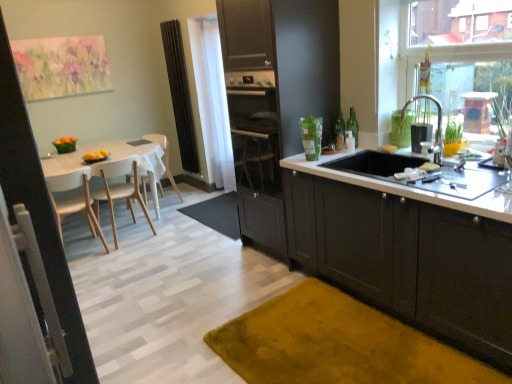
Find the location of a particular element. The image size is (512, 384). matte black cabinets at lower right, the second cabinetry viewed from the left is located at coordinates (408, 260).

Image resolution: width=512 pixels, height=384 pixels. What do you see at coordinates (74, 199) in the screenshot?
I see `white wood chair at left, the first chair positioned from the front` at bounding box center [74, 199].

This screenshot has height=384, width=512. What do you see at coordinates (395, 57) in the screenshot? I see `transparent glass window at upper right` at bounding box center [395, 57].

This screenshot has width=512, height=384. In order to click on mustard yellow carpet at lower right, arranged as the first doormat when viewed from the front in this screenshot , I will do `click(338, 344)`.

This screenshot has width=512, height=384. In order to click on black rubber doormat at center, marked as the first doormat in a back-to-front arrangement in this screenshot , I will do `click(217, 214)`.

Is silver metallic faucet at upper right touching light wood chair at left, the first chair when ordered from back to front?

No, silver metallic faucet at upper right is not making contact with light wood chair at left, the first chair when ordered from back to front.

Which is more to the left, silver metallic faucet at upper right or light wood chair at left, the first chair when ordered from back to front?

From the viewer's perspective, light wood chair at left, the first chair when ordered from back to front, appears more on the left side.

From the image's perspective, is silver metallic faucet at upper right above light wood chair at left, the first chair when ordered from back to front?

Yes, from the image's perspective, silver metallic faucet at upper right is on top of light wood chair at left, the first chair when ordered from back to front.

How different are the orientations of silver metallic faucet at upper right and light wood chair at left, the first chair when ordered from back to front, in degrees?

6.84 degrees separate the facing orientations of silver metallic faucet at upper right and light wood chair at left, the first chair when ordered from back to front.

Is white glossy screen door at upper left in front of transparent glass window at upper right?

Yes, the depth of white glossy screen door at upper left is less than that of transparent glass window at upper right.

Could you tell me if white glossy screen door at upper left is facing transparent glass window at upper right?

Yes, white glossy screen door at upper left is facing transparent glass window at upper right.

Which is farther from the camera, (163, 143) or (382, 184)?

The point (163, 143) is more distant.

From the image's perspective, who appears lower, light wood chair at left, the first chair when ordered from back to front, or white glossy countertop at lower right?

white glossy countertop at lower right appears lower in the image.

Considering the relative positions of light wood chair at left, arranged as the 3th chair when viewed from the front, and white glossy countertop at lower right in the image provided, is light wood chair at left, arranged as the 3th chair when viewed from the front, to the left or to the right of white glossy countertop at lower right?

From the image, it's evident that light wood chair at left, arranged as the 3th chair when viewed from the front, is to the left of white glossy countertop at lower right.

From a real-world perspective, which object rests below the other?

In real-world perspective, light wood chair at left, arranged as the 3th chair when viewed from the front, is lower.

Which object is positioned more to the left, white wood chair at left, the 3th chair when ordered from back to front, or green glass bottle at upper right, the 1th bottle in the right-to-left sequence?

Positioned to the left is white wood chair at left, the 3th chair when ordered from back to front.

Which point is more forward, (94, 235) or (350, 128)?

The point (350, 128) is closer.

Is white wood chair at left, the 3th chair when ordered from back to front, not inside green glass bottle at upper right, the 1th bottle in the right-to-left sequence?

Yes.

How many degrees apart are the facing directions of white wood chair at left, the first chair positioned from the front, and matte black cabinets at lower right, the second cabinetry viewed from the left?

white wood chair at left, the first chair positioned from the front, and matte black cabinets at lower right, the second cabinetry viewed from the left, are facing 89.1 degrees away from each other.

Is white wood chair at left, the 3th chair when ordered from back to front, not close to matte black cabinets at lower right, the second cabinetry viewed from the left?

That's right, there is a large distance between white wood chair at left, the 3th chair when ordered from back to front, and matte black cabinets at lower right, the second cabinetry viewed from the left.

Is point (84, 204) positioned after point (370, 236)?

Yes, it is.

Is the position of matte black cabinets at lower right, the second cabinetry viewed from the left, less distant than that of mustard yellow carpet at lower right, the second doormat viewed from the back?

That is False.

Could you measure the distance between matte black cabinets at lower right, the second cabinetry viewed from the left, and mustard yellow carpet at lower right, the second doormat in the top-to-bottom sequence?

A distance of 16.49 inches exists between matte black cabinets at lower right, the second cabinetry viewed from the left, and mustard yellow carpet at lower right, the second doormat in the top-to-bottom sequence.

Is matte black cabinets at lower right, acting as the 1th cabinetry starting from the right, wider or thinner than mustard yellow carpet at lower right, arranged as the first doormat when viewed from the front?

Clearly, matte black cabinets at lower right, acting as the 1th cabinetry starting from the right, has less width compared to mustard yellow carpet at lower right, arranged as the first doormat when viewed from the front.

From the image's perspective, which is below, matte black cabinets at lower right, acting as the 1th cabinetry starting from the right, or mustard yellow carpet at lower right, the second doormat viewed from the back?

From the image's view, mustard yellow carpet at lower right, the second doormat viewed from the back, is below.

Which is correct: black rubber doormat at center, the 2th doormat in the bottom-to-top sequence, is inside white glossy countertop at lower right, or outside of it?

black rubber doormat at center, the 2th doormat in the bottom-to-top sequence, is outside white glossy countertop at lower right.

Does point (226, 230) come behind point (298, 166)?

Yes, point (226, 230) is farther from viewer.

Does black rubber doormat at center, which is the 2th doormat from front to back, have a greater height compared to white glossy countertop at lower right?

No, black rubber doormat at center, which is the 2th doormat from front to back, is not taller than white glossy countertop at lower right.

You are a GUI agent. You are given a task and a screenshot of the screen. Output one action in this format:
    pyautogui.click(x=<x>, y=<y>)
    Task: Click on the tap in front of the light wood chair at left, the first chair when ordered from back to front
    
    Given the screenshot: What is the action you would take?
    pyautogui.click(x=437, y=125)

Identify the location of window screen behind the white glossy screen door at upper left. (395, 57).

From the image, which object appears to be farther from white wood chair at left, the 3th chair when ordered from back to front, white glossy screen door at upper left or mustard yellow carpet at lower right, arranged as the first doormat when viewed from the front?

Among the two, mustard yellow carpet at lower right, arranged as the first doormat when viewed from the front, is located further to white wood chair at left, the 3th chair when ordered from back to front.

Based on their spatial positions, is white glossy screen door at upper left or white wood table at left closer to transparent glass window at upper right?

Among the two, white glossy screen door at upper left is located nearer to transparent glass window at upper right.

From the picture: Based on their spatial positions, is white wood table at left or white wood chair at left, which is the 2th chair from front to back, further from light wood chair at left, the first chair when ordered from back to front?

white wood chair at left, which is the 2th chair from front to back, is positioned further to the anchor light wood chair at left, the first chair when ordered from back to front.

Considering their positions, is black rubber doormat at center, the 2th doormat in the bottom-to-top sequence, positioned closer to transparent glass window at upper right than green glass bottle at upper right, placed as the 2th bottle when sorted from left to right?

green glass bottle at upper right, placed as the 2th bottle when sorted from left to right, lies closer to transparent glass window at upper right than the other object.

Estimate the real-world distances between objects in this image. Which object is closer to green glass bottle at upper right, placed as the 2th bottle when sorted from left to right, transparent glass window at upper right or white glossy countertop at lower right?

The object closer to green glass bottle at upper right, placed as the 2th bottle when sorted from left to right, is transparent glass window at upper right.

Which object lies further to the anchor point white glossy screen door at upper left, white wood chair at left, the first chair positioned from the front, or light wood chair at left, the first chair when ordered from back to front?

light wood chair at left, the first chair when ordered from back to front, lies further to white glossy screen door at upper left than the other object.

Considering their positions, is white sheer curtain at center positioned further to matte black cabinets at lower right, the second cabinetry viewed from the left, than white wood chair at left, the first chair positioned from the front?

white sheer curtain at center is further to matte black cabinets at lower right, the second cabinetry viewed from the left.

Which object lies further to the anchor point matte black cabinets at lower right, acting as the 1th cabinetry starting from the right, light wood chair at left, the first chair when ordered from back to front, or black rubber doormat at center, marked as the first doormat in a back-to-front arrangement?

Among the two, light wood chair at left, the first chair when ordered from back to front, is located further to matte black cabinets at lower right, acting as the 1th cabinetry starting from the right.

Image resolution: width=512 pixels, height=384 pixels. Identify the location of bottle positioned between white glossy countertop at lower right and green glass bottle at upper right, placed as the second bottle when sorted from right to left, from near to far. (353, 126).

In order to click on screen door situated between white wood table at left and green glass bottle at upper right, placed as the 2th bottle when sorted from left to right, from left to right in this screenshot , I will do `click(38, 210)`.

This screenshot has width=512, height=384. What are the coordinates of `curtain between light wood chair at left, the first chair when ordered from back to front, and green glass bottle at upper right, the 1th bottle in the right-to-left sequence, from left to right` in the screenshot? It's located at (212, 100).

At what (x,y) coordinates should I click in order to perform the action: click on kitchen & dining room table located between white wood chair at left, the first chair positioned from the front, and green glass bottle at upper right, placed as the 2th bottle when sorted from left to right, in the left-right direction. Please return your answer as a coordinate pair (x, y). The image size is (512, 384). Looking at the image, I should click on (112, 160).